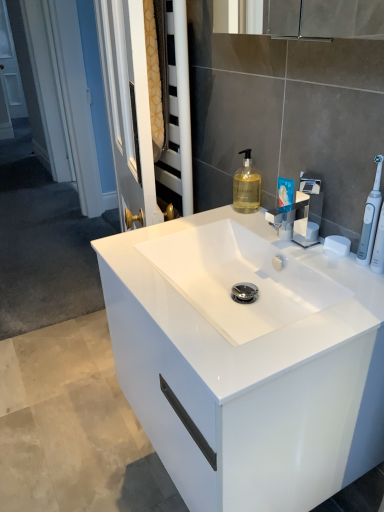
At what (x,y) coordinates should I click in order to perform the action: click on white glossy cabinet at center. Please return your answer as a coordinate pair (x, y). Looking at the image, I should click on (247, 361).

At what (x,y) coordinates should I click in order to perform the action: click on satin nickel faucet at center. Please return your answer as a coordinate pair (x, y). This screenshot has width=384, height=512. Looking at the image, I should click on [x=300, y=213].

This screenshot has width=384, height=512. What do you see at coordinates (246, 186) in the screenshot?
I see `translucent yellow liquid at center` at bounding box center [246, 186].

Locate an element on the screen. This screenshot has height=512, width=384. white glossy cabinet at center is located at coordinates (247, 361).

Is white plastic toothbrush at right positioned beyond the bounds of white matte soap at upper right?

Yes, white plastic toothbrush at right is outside of white matte soap at upper right.

Between point (368, 236) and point (327, 241), which one is positioned in front?

The point (368, 236) is more forward.

From the picture: Is white plastic toothbrush at right in front of or behind white matte soap at upper right in the image?

In the image, white plastic toothbrush at right appears in front of white matte soap at upper right.

Is there a large distance between white plastic toothbrush at right and white matte soap at upper right?

They are positioned close to each other.

Does point (285, 239) come farther from viewer compared to point (281, 229)?

That is False.

Is satin nickel faucet at center spatially inside blue glossy toothpaste tube at upper right, or outside of it?

The correct answer is: outside.

At what (x,y) coordinates should I click in order to perform the action: click on tap on the right of blue glossy toothpaste tube at upper right. Please return your answer as a coordinate pair (x, y). This screenshot has height=512, width=384. Looking at the image, I should click on (300, 213).

From a real-world perspective, is satin nickel faucet at center physically below blue glossy toothpaste tube at upper right?

No.

Which object is positioned more to the left, white matte soap at upper right or white glossy cabinet at center?

white glossy cabinet at center is more to the left.

Based on the photo, is white matte soap at upper right not close to white glossy cabinet at center?

No, white matte soap at upper right is in close proximity to white glossy cabinet at center.

You are a GUI agent. You are given a task and a screenshot of the screen. Output one action in this format:
    pyautogui.click(x=<x>, y=<y>)
    Task: Click on the bathroom cabinet located below the white matte soap at upper right (from the image's perspective)
    The height and width of the screenshot is (512, 384).
    Given the screenshot: What is the action you would take?
    pyautogui.click(x=247, y=361)

How many degrees apart are the facing directions of satin nickel faucet at center and translucent yellow liquid at center?

The angle between the facing direction of satin nickel faucet at center and the facing direction of translucent yellow liquid at center is 1.35 degrees.

From a real-world perspective, which object rests below the other?

In real-world perspective, satin nickel faucet at center is lower.

Is satin nickel faucet at center inside or outside of translucent yellow liquid at center?

satin nickel faucet at center exists outside the volume of translucent yellow liquid at center.

Which object is further away from the camera taking this photo, satin nickel faucet at center or translucent yellow liquid at center?

translucent yellow liquid at center is further away from the camera.

From a real-world perspective, is white matte soap at upper right positioned under translucent yellow liquid at center based on gravity?

Yes, from a real-world perspective, white matte soap at upper right is under translucent yellow liquid at center.

From the picture: Does white matte soap at upper right turn towards translucent yellow liquid at center?

No, white matte soap at upper right is not turned towards translucent yellow liquid at center.

Between white matte soap at upper right and translucent yellow liquid at center, which one is positioned behind?

translucent yellow liquid at center.

Is white matte soap at upper right next to translucent yellow liquid at center?

No, white matte soap at upper right is not making contact with translucent yellow liquid at center.

Is point (350, 244) closer to viewer compared to point (374, 233)?

No, (350, 244) is behind (374, 233).

In the scene shown: From a real-world perspective, is white matte soap at upper right over white plastic toothbrush at right?

No, from a real-world perspective, white matte soap at upper right is not on top of white plastic toothbrush at right.

Considering their positions, is white matte soap at upper right located in front of or behind white plastic toothbrush at right?

white matte soap at upper right is behind white plastic toothbrush at right.

Is white matte soap at upper right oriented towards white plastic toothbrush at right?

No, white matte soap at upper right is not oriented towards white plastic toothbrush at right.

In the scene shown: From a real-world perspective, is white plastic toothbrush at right above or below translucent yellow liquid at center?

white plastic toothbrush at right is above translucent yellow liquid at center.

In the scene shown: In terms of width, does white plastic toothbrush at right look wider or thinner when compared to translucent yellow liquid at center?

In the image, white plastic toothbrush at right appears to be more narrow than translucent yellow liquid at center.

Based on the photo, could you tell me if white plastic toothbrush at right is turned towards translucent yellow liquid at center?

No, white plastic toothbrush at right is not facing towards translucent yellow liquid at center.

Is white plastic toothbrush at right shorter than translucent yellow liquid at center?

Incorrect, the height of white plastic toothbrush at right does not fall short of that of translucent yellow liquid at center.

You are a GUI agent. You are given a task and a screenshot of the screen. Output one action in this format:
    pyautogui.click(x=<x>, y=<y>)
    Task: Click on the toothbrush in front of the white matte soap at upper right
    The width and height of the screenshot is (384, 512).
    Given the screenshot: What is the action you would take?
    pyautogui.click(x=370, y=218)

At what (x,y) coordinates should I click in order to perform the action: click on tap below the blue glossy toothpaste tube at upper right (from the image's perspective). Please return your answer as a coordinate pair (x, y). Looking at the image, I should click on (300, 213).

Estimate the real-world distances between objects in this image. Which object is closer to blue glossy toothpaste tube at upper right, white glossy cabinet at center or white plastic toothbrush at right?

The object closer to blue glossy toothpaste tube at upper right is white plastic toothbrush at right.

From the image, which object appears to be nearer to white plastic toothbrush at right, blue glossy toothpaste tube at upper right or white glossy cabinet at center?

blue glossy toothpaste tube at upper right is closer to white plastic toothbrush at right.

From the image, which object appears to be farther from white plastic toothbrush at right, white matte soap at upper right or satin nickel faucet at center?

The object further to white plastic toothbrush at right is satin nickel faucet at center.

When comparing their distances from satin nickel faucet at center, does blue glossy toothpaste tube at upper right or translucent yellow liquid at center seem closer?

blue glossy toothpaste tube at upper right.

Considering their positions, is satin nickel faucet at center positioned further to blue glossy toothpaste tube at upper right than white plastic toothbrush at right?

white plastic toothbrush at right.

Based on their spatial positions, is translucent yellow liquid at center or satin nickel faucet at center further from white plastic toothbrush at right?

translucent yellow liquid at center is positioned further to the anchor white plastic toothbrush at right.

Estimate the real-world distances between objects in this image. Which object is closer to white plastic toothbrush at right, blue glossy toothpaste tube at upper right or white matte soap at upper right?

Based on the image, white matte soap at upper right appears to be nearer to white plastic toothbrush at right.

Considering their positions, is translucent yellow liquid at center positioned further to satin nickel faucet at center than white matte soap at upper right?

Among the two, translucent yellow liquid at center is located further to satin nickel faucet at center.

This screenshot has height=512, width=384. Find the location of `soap between blue glossy toothpaste tube at upper right and white glossy cabinet at center in the up-down direction`. soap between blue glossy toothpaste tube at upper right and white glossy cabinet at center in the up-down direction is located at coordinates (336, 246).

The height and width of the screenshot is (512, 384). Find the location of `soap between translucent yellow liquid at center and white glossy cabinet at center in the up-down direction`. soap between translucent yellow liquid at center and white glossy cabinet at center in the up-down direction is located at coordinates (336, 246).

Find the location of `soap positioned between satin nickel faucet at center and translucent yellow liquid at center from near to far`. soap positioned between satin nickel faucet at center and translucent yellow liquid at center from near to far is located at coordinates (336, 246).

You are a GUI agent. You are given a task and a screenshot of the screen. Output one action in this format:
    pyautogui.click(x=<x>, y=<y>)
    Task: Click on the toiletry located between satin nickel faucet at center and translucent yellow liquid at center in the depth direction
    The image size is (384, 512).
    Given the screenshot: What is the action you would take?
    pyautogui.click(x=285, y=206)